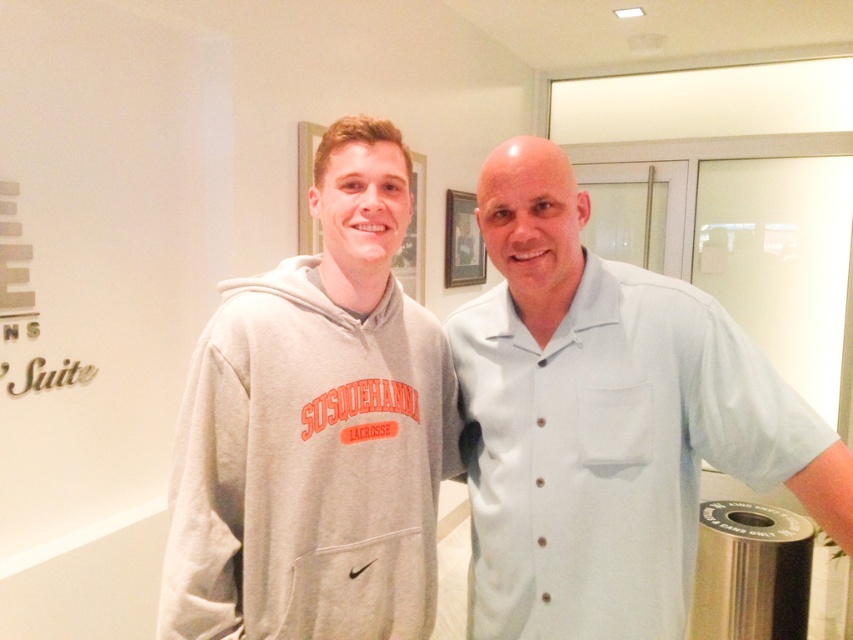
Question: Can you confirm if light blue button-up shirt at right is positioned to the left of gray fleece hoodie at center?

Choices:
 (A) yes
 (B) no

Answer: (B)

Question: Which object is farther from the camera taking this photo?

Choices:
 (A) gray fleece hoodie at center
 (B) light blue button-up shirt at right

Answer: (A)

Question: Which of the following is the closest to the observer?

Choices:
 (A) light blue button-up shirt at right
 (B) gray fleece hoodie at center

Answer: (A)

Question: From the image, what is the correct spatial relationship of light blue button-up shirt at right in relation to gray fleece hoodie at center?

Choices:
 (A) left
 (B) right

Answer: (B)

Question: Can you confirm if light blue button-up shirt at right is bigger than gray fleece hoodie at center?

Choices:
 (A) yes
 (B) no

Answer: (A)